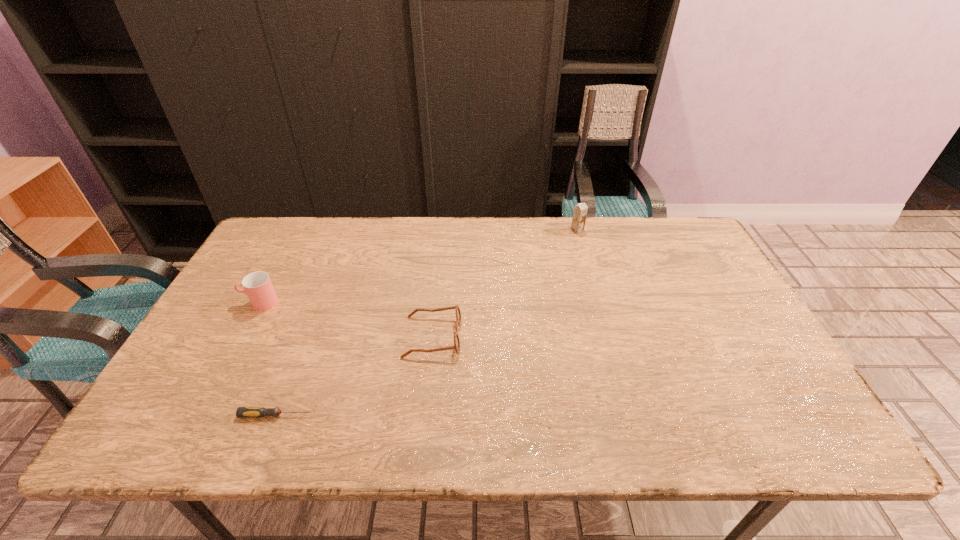
What are the coordinates of `chocolate milk` in the screenshot? It's located at (580, 211).

You are a GUI agent. You are given a task and a screenshot of the screen. Output one action in this format:
    pyautogui.click(x=<x>, y=<y>)
    Task: Click on the farthest object
    Image resolution: width=960 pixels, height=540 pixels.
    Given the screenshot: What is the action you would take?
    pyautogui.click(x=580, y=211)

At what (x,y) coordinates should I click in order to perform the action: click on the third shortest object. Please return your answer as a coordinate pair (x, y). The width and height of the screenshot is (960, 540). Looking at the image, I should click on (257, 285).

You are a GUI agent. You are given a task and a screenshot of the screen. Output one action in this format:
    pyautogui.click(x=<x>, y=<y>)
    Task: Click on the cup
    The width and height of the screenshot is (960, 540).
    Given the screenshot: What is the action you would take?
    pyautogui.click(x=257, y=285)

Where is `the second object from right to left`? the second object from right to left is located at coordinates (456, 346).

Locate an element on the screen. Image resolution: width=960 pixels, height=540 pixels. spectacles is located at coordinates (456, 346).

Locate an element on the screen. the nearest object is located at coordinates (242, 412).

Where is `screwdriver`? The width and height of the screenshot is (960, 540). screwdriver is located at coordinates (242, 412).

The width and height of the screenshot is (960, 540). Identify the location of vacant space located on the right of the tallest object. (660, 230).

In order to click on vacant space situated 0.060m on the side of the leftmost object with the handle in this screenshot , I will do `click(221, 303)`.